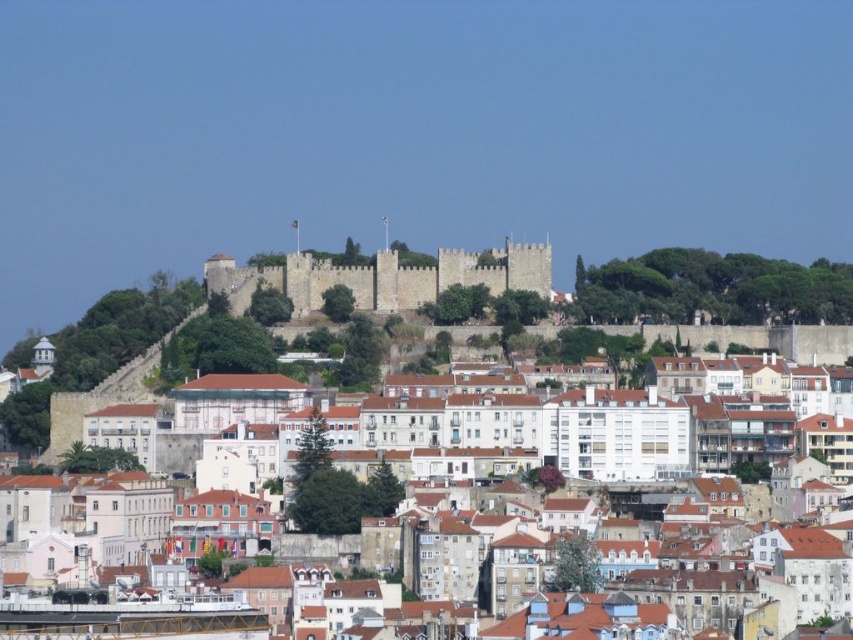
You are an architect analyzing the city layout. From your vantage point, which structure blocks the view of the other between the white stone buildings at center and the gray stone castle at center?

The white stone buildings at center are in front of the gray stone castle at center, so they block the view of the gray stone castle at center.

You are standing at the viewpoint overlooking the city and notice two points marked on the horizon. The first point is located at coordinates point (x=593, y=392), and the second at point (x=541, y=289). Based on the city layout, which point is closer to you?

Point (x=593, y=392) is in front of point (x=541, y=289), so it is closer to you.